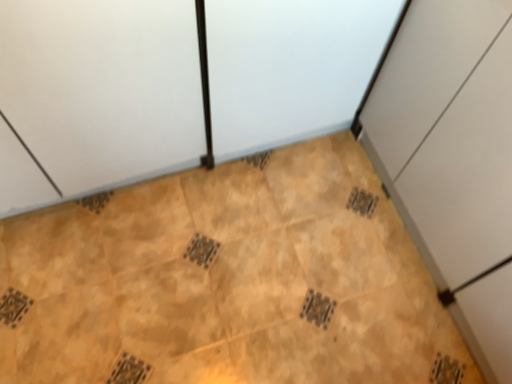
What do you see at coordinates (453, 159) in the screenshot? I see `white matte cabinet at right` at bounding box center [453, 159].

Identify the location of white matte cabinet at right. Image resolution: width=512 pixels, height=384 pixels. (453, 159).

This screenshot has width=512, height=384. Find the location of `brown textured tile at center`. brown textured tile at center is located at coordinates (227, 281).

This screenshot has height=384, width=512. What do you see at coordinates (227, 281) in the screenshot?
I see `brown textured tile at center` at bounding box center [227, 281].

I want to click on white matte cabinet at right, so click(453, 159).

From the picture: Does brown textured tile at center appear on the left side of white matte cabinet at right?

Yes.

Considering their positions, is brown textured tile at center located in front of or behind white matte cabinet at right?

In the image, brown textured tile at center appears behind white matte cabinet at right.

Is point (163, 317) in front of point (413, 42)?

No, (163, 317) is further to viewer.

From the image's perspective, is brown textured tile at center under white matte cabinet at right?

Yes, from the image's perspective, brown textured tile at center is below white matte cabinet at right.

From a real-world perspective, is brown textured tile at center below white matte cabinet at right?

Yes, from a real-world perspective, brown textured tile at center is under white matte cabinet at right.

Can you confirm if brown textured tile at center is thinner than white matte cabinet at right?

No.

Considering the relative sizes of brown textured tile at center and white matte cabinet at right in the image provided, is brown textured tile at center taller than white matte cabinet at right?

In fact, brown textured tile at center may be shorter than white matte cabinet at right.

Based on the photo, between brown textured tile at center and white matte cabinet at right, which one has smaller size?

brown textured tile at center is smaller.

Is brown textured tile at center inside or outside of white matte cabinet at right?

brown textured tile at center exists outside the volume of white matte cabinet at right.

Are brown textured tile at center and white matte cabinet at right beside each other?

No, brown textured tile at center is not in contact with white matte cabinet at right.

Is brown textured tile at center facing towards white matte cabinet at right?

No, brown textured tile at center is not facing towards white matte cabinet at right.

At what (x,y) coordinates should I click in order to perform the action: click on cabinetry on the right of brown textured tile at center. Please return your answer as a coordinate pair (x, y). Looking at the image, I should click on (453, 159).

Considering the relative positions of white matte cabinet at right and brown textured tile at center in the image provided, is white matte cabinet at right to the right of brown textured tile at center from the viewer's perspective?

Indeed, white matte cabinet at right is positioned on the right side of brown textured tile at center.

Is white matte cabinet at right further to the viewer compared to brown textured tile at center?

No, the depth of white matte cabinet at right is less than that of brown textured tile at center.

Does point (503, 204) lie in front of point (391, 376)?

Yes, it is in front of point (391, 376).

From the image's perspective, is white matte cabinet at right beneath brown textured tile at center?

No, from the image's perspective, white matte cabinet at right is not beneath brown textured tile at center.

From a real-world perspective, who is located higher, white matte cabinet at right or brown textured tile at center?

white matte cabinet at right, from a real-world perspective.

Which object is thinner, white matte cabinet at right or brown textured tile at center?

white matte cabinet at right.

Based on the photo, in terms of height, does white matte cabinet at right look taller or shorter compared to brown textured tile at center?

Clearly, white matte cabinet at right is taller compared to brown textured tile at center.

Considering the relative sizes of white matte cabinet at right and brown textured tile at center in the image provided, is white matte cabinet at right smaller than brown textured tile at center?

No, white matte cabinet at right is not smaller than brown textured tile at center.

Is white matte cabinet at right situated inside brown textured tile at center or outside?

white matte cabinet at right is not inside brown textured tile at center, it's outside.

Does white matte cabinet at right touch brown textured tile at center?

There is a gap between white matte cabinet at right and brown textured tile at center.

Could you tell me if white matte cabinet at right is facing brown textured tile at center?

Yes, white matte cabinet at right is turned towards brown textured tile at center.

What's the angular difference between white matte cabinet at right and brown textured tile at center's facing directions?

There is a 2.22-degree angle between the facing directions of white matte cabinet at right and brown textured tile at center.

How far apart are white matte cabinet at right and brown textured tile at center?

white matte cabinet at right and brown textured tile at center are 17.27 inches apart.

The image size is (512, 384). Identify the location of cabinetry on the right of brown textured tile at center. (453, 159).

Identify the location of cabinetry that is in front of the brown textured tile at center. This screenshot has width=512, height=384. (453, 159).

In order to click on cabinetry above the brown textured tile at center (from a real-world perspective) in this screenshot , I will do `click(453, 159)`.